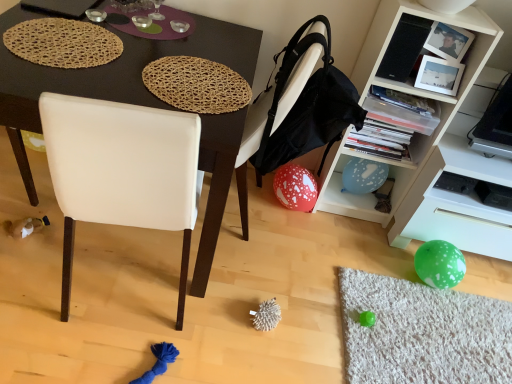
At what (x,y) coordinates should I click in order to perform the action: click on free location in front of white plastic shelf at lower right. Please return your answer as a coordinate pair (x, y). The height and width of the screenshot is (384, 512). Looking at the image, I should click on (450, 315).